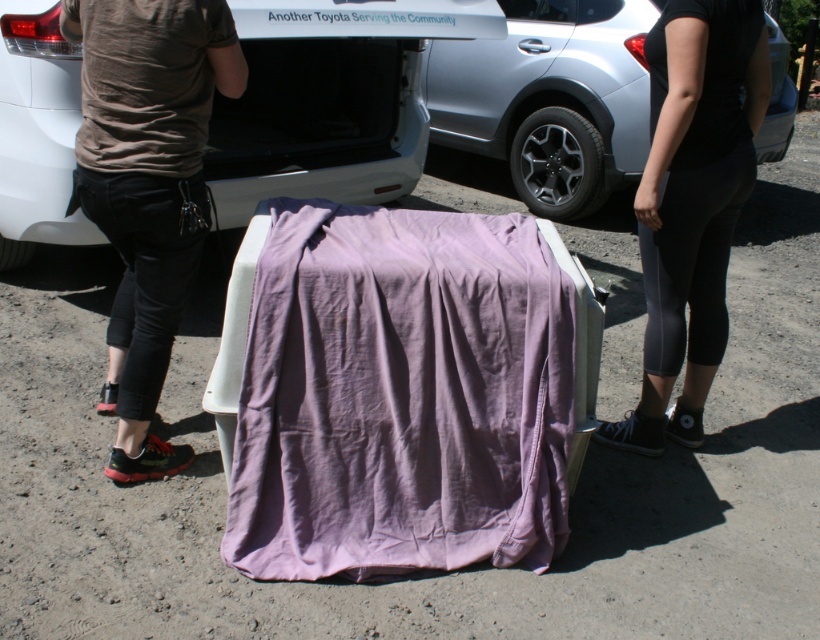
How far apart are black fabric pants at lower right and silver metallic car at center?

They are 8.34 feet apart.

Is black fabric pants at lower right below silver metallic car at center?

Indeed, black fabric pants at lower right is positioned under silver metallic car at center.

The width and height of the screenshot is (820, 640). Describe the element at coordinates (691, 204) in the screenshot. I see `black fabric pants at lower right` at that location.

I want to click on black fabric pants at lower right, so click(x=691, y=204).

Does purple cotton blanket at center have a smaller size compared to black fabric pants at lower right?

Incorrect, purple cotton blanket at center is not smaller in size than black fabric pants at lower right.

Is point (565, 541) more distant than point (738, 163)?

No, it is not.

Is point (502, 560) less distant than point (720, 54)?

Yes, it is in front of point (720, 54).

The height and width of the screenshot is (640, 820). In order to click on purple cotton blanket at center in this screenshot , I will do `click(399, 396)`.

Which is more to the left, purple cotton blanket at center or white matte car at center?

white matte car at center

Does purple cotton blanket at center appear on the left side of white matte car at center?

Incorrect, purple cotton blanket at center is not on the left side of white matte car at center.

Find the location of a particular element. purple cotton blanket at center is located at coordinates (399, 396).

Image resolution: width=820 pixels, height=640 pixels. Find the location of `purple cotton blanket at center`. purple cotton blanket at center is located at coordinates (399, 396).